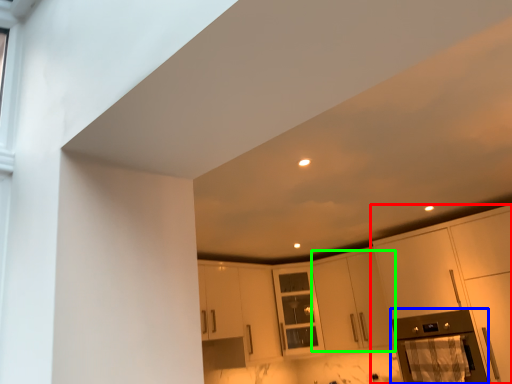
Question: Based on their relative distances, which object is farther from cabinetry (highlighted by a red box)? Choose from appliance (highlighted by a blue box) and cabinetry (highlighted by a green box).

Choices:
 (A) appliance
 (B) cabinetry

Answer: (B)